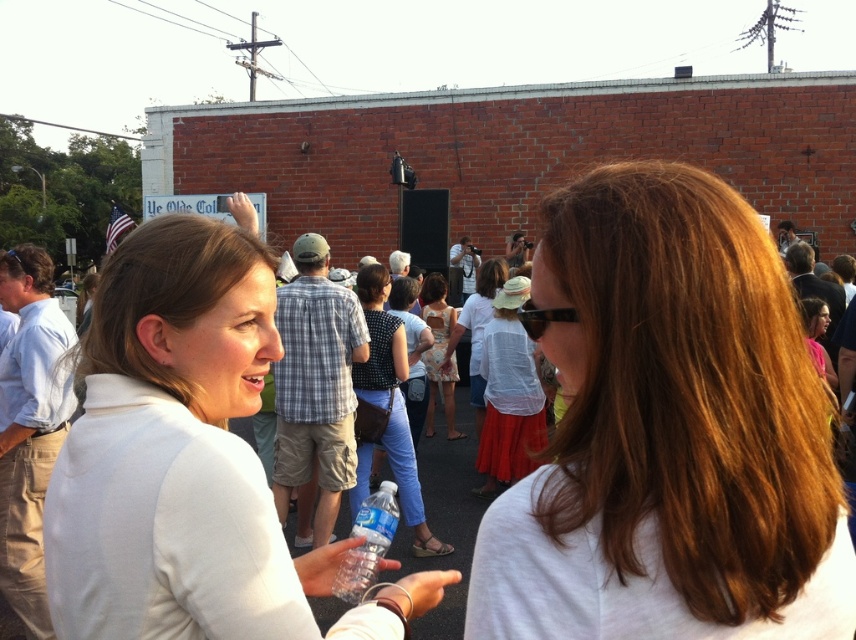
You are a photographer trying to capture a candid shot of the two people in the scene. You need to ensure that both the white matte shirt at center and the clear plastic water bottle at center are in focus. Given that your camera has a depth of field that can cover 24 inches, will you be able to achieve this?

The distance between the white matte shirt at center and the clear plastic water bottle at center is 23.88 inches, which is within the camera depth of field of 24 inches. Therefore, both objects will be in focus.

You are at an event and see two people talking. There is a shiny brown hair at center and a white matte shirt at center. Which one is positioned more to the right?

The shiny brown hair at center is positioned to the right of the white matte shirt at center.

You are a photographer at this event and want to capture both the shiny brown hair at center and the clear plastic water bottle at center in a single shot. Given that the camera can only focus on objects larger than 10 cm, will both objects be in focus?

The shiny brown hair at center has a larger size compared to clear plastic water bottle at center. Since the camera requires objects to be larger than 10 cm to focus, and the shiny brown hair is larger, it will be in focus. However, the clear plastic water bottle at center may be smaller than 10 cm and thus might not be in focus. Therefore, only the shiny brown hair at center will be in focus.